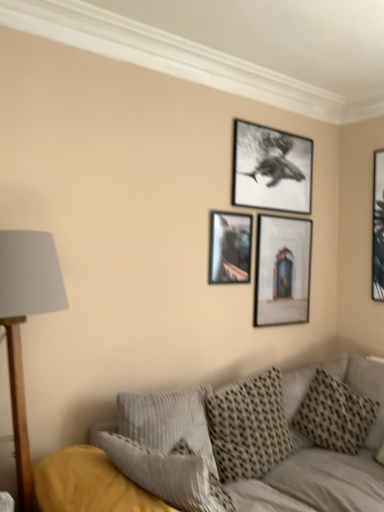
Question: Is black matte picture frame at upper center, positioned as the second picture frame in left-to-right order, surrounded by patterned fabric pillow at center, acting as the second pillow starting from the right?

Choices:
 (A) no
 (B) yes

Answer: (A)

Question: Does patterned fabric pillow at center, arranged as the second pillow when viewed from the left, come in front of black matte picture frame at upper center, positioned as the second picture frame in left-to-right order?

Choices:
 (A) yes
 (B) no

Answer: (A)

Question: From the image's perspective, does patterned fabric pillow at center, arranged as the second pillow when viewed from the left, appear lower than black matte picture frame at upper center, the 3th picture frame in the right-to-left sequence?

Choices:
 (A) no
 (B) yes

Answer: (B)

Question: From a real-world perspective, is patterned fabric pillow at center, acting as the second pillow starting from the right, on black matte picture frame at upper center, positioned as the second picture frame in left-to-right order?

Choices:
 (A) yes
 (B) no

Answer: (B)

Question: Is patterned fabric pillow at center, arranged as the second pillow when viewed from the left, taller than black matte picture frame at upper center, positioned as the second picture frame in left-to-right order?

Choices:
 (A) yes
 (B) no

Answer: (A)

Question: Relative to textured gray couch at lower right, is wooden base with gray fabric lampshade at left in front or behind?

Choices:
 (A) behind
 (B) front

Answer: (A)

Question: From a real-world perspective, is wooden base with gray fabric lampshade at left above or below textured gray couch at lower right?

Choices:
 (A) below
 (B) above

Answer: (B)

Question: Is wooden base with gray fabric lampshade at left bigger or smaller than textured gray couch at lower right?

Choices:
 (A) small
 (B) big

Answer: (A)

Question: From the image's perspective, relative to textured gray couch at lower right, is wooden base with gray fabric lampshade at left above or below?

Choices:
 (A) below
 (B) above

Answer: (B)

Question: Is metallic silver picture frame at center, which ranks as the 4th picture frame in right-to-left order, in front of or behind patterned fabric pillow at center, arranged as the second pillow when viewed from the left, in the image?

Choices:
 (A) behind
 (B) front

Answer: (A)

Question: Is metallic silver picture frame at center, which ranks as the 4th picture frame in right-to-left order, taller or shorter than patterned fabric pillow at center, arranged as the second pillow when viewed from the left?

Choices:
 (A) short
 (B) tall

Answer: (A)

Question: Would you say metallic silver picture frame at center, placed as the first picture frame when sorted from left to right, is to the left or to the right of patterned fabric pillow at center, arranged as the second pillow when viewed from the left, in the picture?

Choices:
 (A) right
 (B) left

Answer: (B)

Question: Looking at their shapes, would you say metallic silver picture frame at center, placed as the first picture frame when sorted from left to right, is wider or thinner than patterned fabric pillow at center, acting as the second pillow starting from the right?

Choices:
 (A) thin
 (B) wide

Answer: (A)

Question: Based on their sizes in the image, would you say metallic silver picture frame at center, which ranks as the 4th picture frame in right-to-left order, is bigger or smaller than matte wooden picture frame at center, which ranks as the 2th picture frame in right-to-left order?

Choices:
 (A) small
 (B) big

Answer: (A)

Question: Considering the positions of metallic silver picture frame at center, placed as the first picture frame when sorted from left to right, and matte wooden picture frame at center, which ranks as the 2th picture frame in right-to-left order, in the image, is metallic silver picture frame at center, placed as the first picture frame when sorted from left to right, taller or shorter than matte wooden picture frame at center, which ranks as the 2th picture frame in right-to-left order,?

Choices:
 (A) tall
 (B) short

Answer: (B)